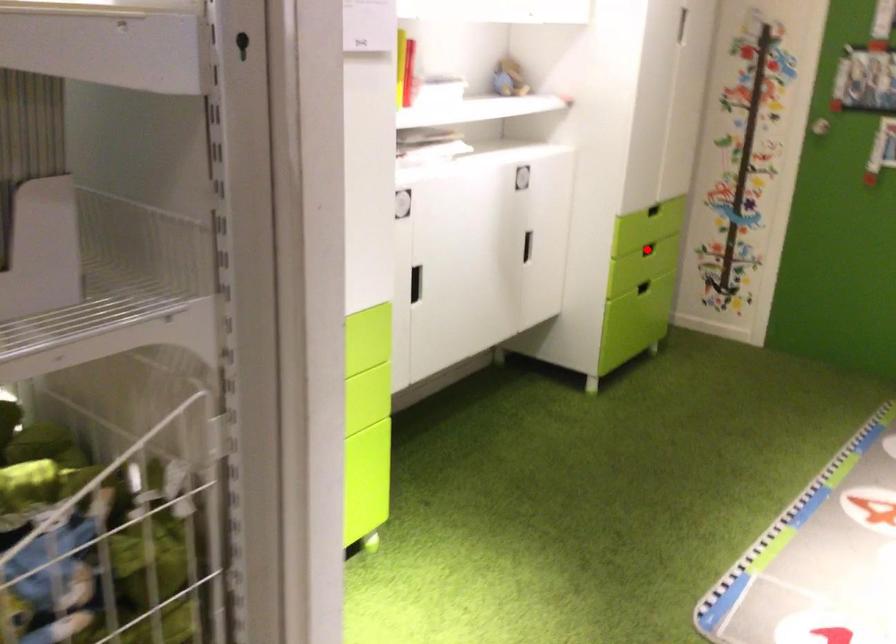
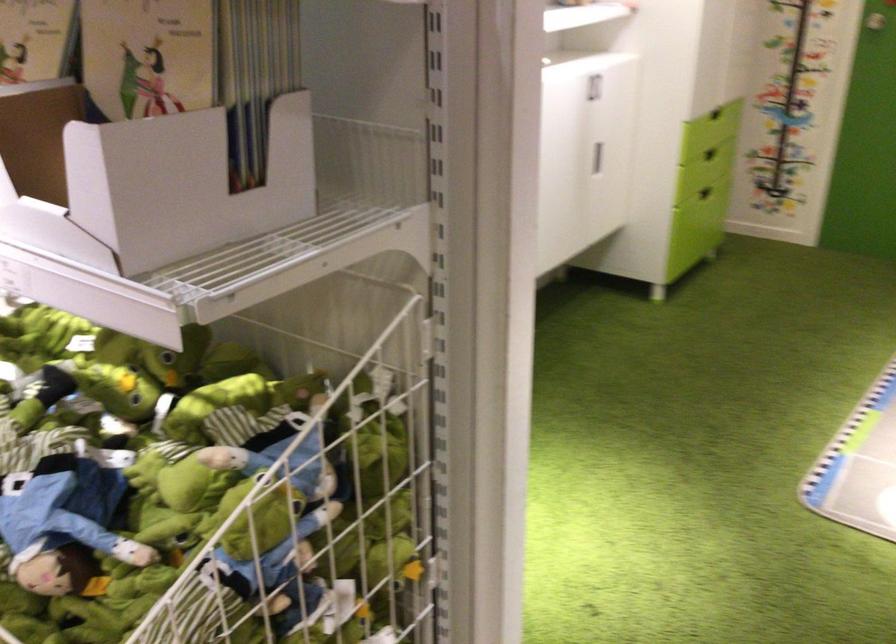
Locate, in the second image, the point that corresponds to the highlighted location in the first image.

(710, 154)